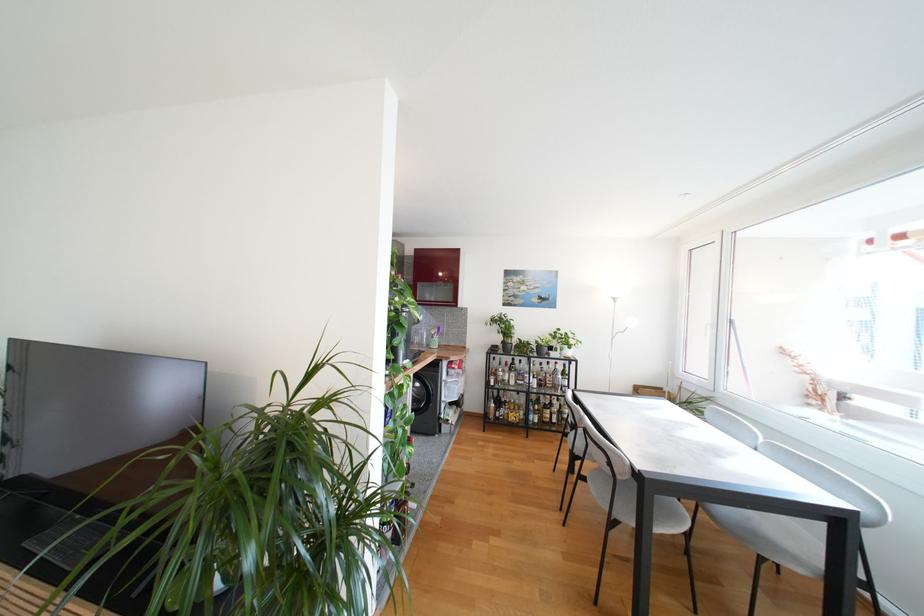
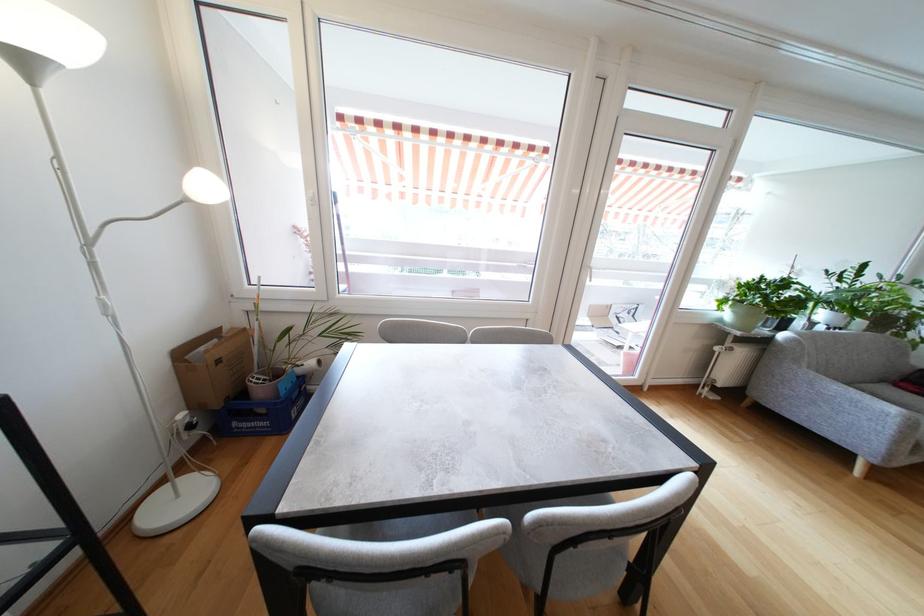
Where in the second image is the point corresponding to pixel 617 341 from the first image?

(93, 246)